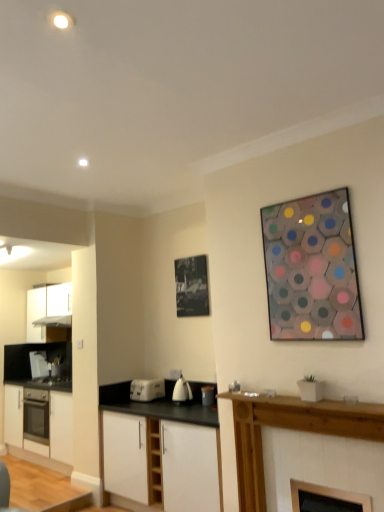
Question: Which direction should I rotate to look at black paper at upper center, positioned as the 2th picture frame in right-to-left order, — up or down?

Choices:
 (A) down
 (B) up

Answer: (A)

Question: Does white matte cabinet at lower center, the 2th cabinetry viewed from the front, appear on the left side of metallic silver toaster at center, arranged as the second appliance when viewed from the right?

Choices:
 (A) no
 (B) yes

Answer: (B)

Question: Is white matte cabinet at lower center, which ranks as the 3th cabinetry in left-to-right order, in contact with metallic silver toaster at center, which is the 2th appliance in left-to-right order?

Choices:
 (A) yes
 (B) no

Answer: (B)

Question: Is there a large distance between white matte cabinet at lower center, the 2th cabinetry viewed from the front, and metallic silver toaster at center, which is the 2th appliance in left-to-right order?

Choices:
 (A) yes
 (B) no

Answer: (B)

Question: Does white matte cabinet at lower center, the 2th cabinetry viewed from the front, have a lesser height compared to metallic silver toaster at center, the second appliance in the back-to-front sequence?

Choices:
 (A) yes
 (B) no

Answer: (B)

Question: Does white matte cabinet at lower center, the 2th cabinetry viewed from the front, have a greater height compared to metallic silver toaster at center, the 2th appliance positioned from the front?

Choices:
 (A) yes
 (B) no

Answer: (A)

Question: Is white matte cabinet at lower center, the second cabinetry in the right-to-left sequence, positioned before metallic silver toaster at center, arranged as the second appliance when viewed from the right?

Choices:
 (A) yes
 (B) no

Answer: (A)

Question: From the image's perspective, does black paper at upper center, the 2th picture frame in the front-to-back sequence, appear higher than white plastic toaster at lower center, the 2th kitchen appliance in the right-to-left sequence?

Choices:
 (A) yes
 (B) no

Answer: (A)

Question: Is black paper at upper center, which appears as the first picture frame when viewed from the back, next to white plastic toaster at lower center, the 2th kitchen appliance in the right-to-left sequence, and touching it?

Choices:
 (A) no
 (B) yes

Answer: (A)

Question: Is black paper at upper center, the 2th picture frame in the front-to-back sequence, at the left side of white plastic toaster at lower center, placed as the 2th kitchen appliance when sorted from front to back?

Choices:
 (A) no
 (B) yes

Answer: (A)

Question: Does black paper at upper center, the 2th picture frame in the front-to-back sequence, have a greater width compared to white plastic toaster at lower center, positioned as the 1th kitchen appliance in left-to-right order?

Choices:
 (A) no
 (B) yes

Answer: (A)

Question: Is the position of black paper at upper center, positioned as the first picture frame in left-to-right order, less distant than that of white plastic toaster at lower center, placed as the 2th kitchen appliance when sorted from front to back?

Choices:
 (A) no
 (B) yes

Answer: (B)

Question: Is black paper at upper center, positioned as the 2th picture frame in right-to-left order, not close to white plastic toaster at lower center, positioned as the 1th kitchen appliance in left-to-right order?

Choices:
 (A) no
 (B) yes

Answer: (A)

Question: Is satin silver exhaust hood at left bigger than white plastic toaster at left, marked as the 1th appliance in a left-to-right arrangement?

Choices:
 (A) no
 (B) yes

Answer: (B)